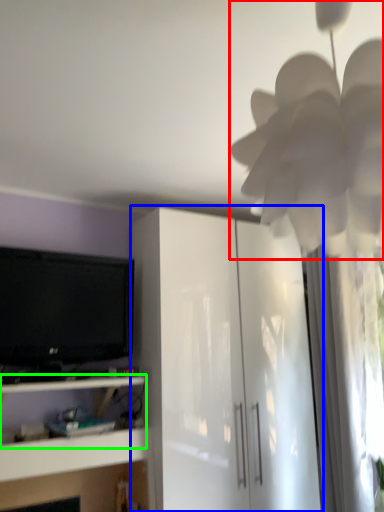
Question: Which object is the closest to the flower (highlighted by a red box)? Choose among these: cabinetry (highlighted by a blue box) or shelf (highlighted by a green box).

Choices:
 (A) cabinetry
 (B) shelf

Answer: (A)